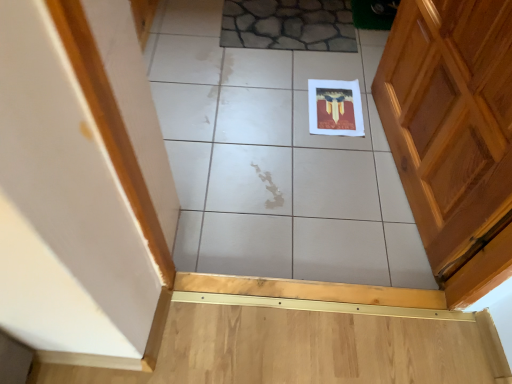
Identify the location of free space above stone-like ceramic tile at upper center, the 1th ceramic tile from the top (from a real-world perspective). (286, 14).